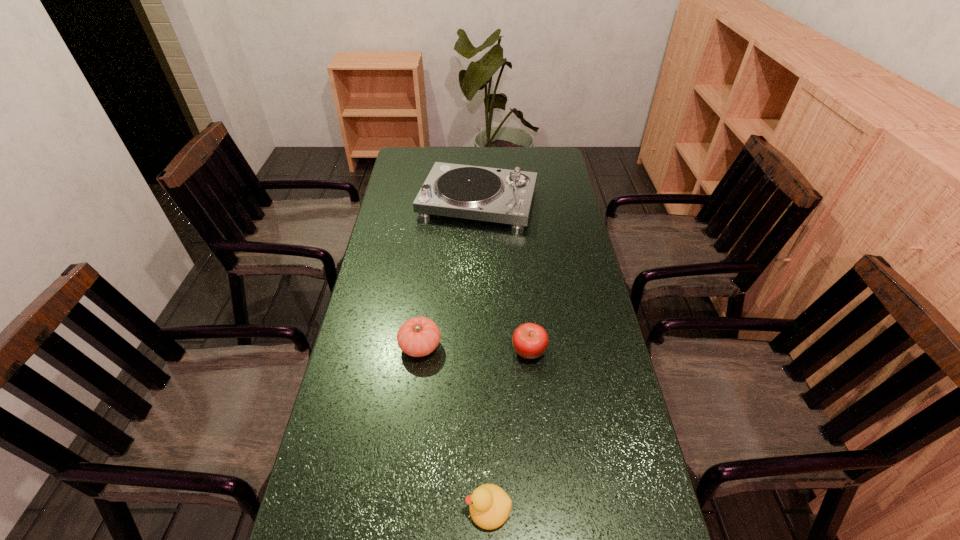
The width and height of the screenshot is (960, 540). What are the coordinates of `vacant area that lies between the tomato and the shortest object` in the screenshot? It's located at (454, 427).

You are a GUI agent. You are given a task and a screenshot of the screen. Output one action in this format:
    pyautogui.click(x=<x>, y=<y>)
    Task: Click on the vacant region between the apple and the nearest object
    
    Given the screenshot: What is the action you would take?
    pyautogui.click(x=509, y=429)

The image size is (960, 540). I want to click on vacant area between the apple and the farthest object, so click(x=504, y=276).

Identify the location of free space that is in between the farthest object and the apple. (504, 276).

Identify which object is located as the nearest to the shortest object. Please provide its 2D coordinates. Your answer should be formatted as a tuple, i.e. [(x, y)], where the tuple contains the x and y coordinates of a point satisfying the conditions above.

[(530, 341)]

Where is `object that can be found as the second closest to the tomato`? object that can be found as the second closest to the tomato is located at coordinates (489, 505).

At what (x,y) coordinates should I click in order to perform the action: click on free region that satisfies the following two spatial constraints: 1. on the front side of the tomato; 2. on the left side of the apple. Please return your answer as a coordinate pair (x, y). Looking at the image, I should click on (420, 350).

This screenshot has height=540, width=960. What are the coordinates of `vacant point that satisfies the following two spatial constraints: 1. on the back side of the farthest object; 2. on the left side of the tomato` in the screenshot? It's located at (438, 202).

You are a GUI agent. You are given a task and a screenshot of the screen. Output one action in this format:
    pyautogui.click(x=<x>, y=<y>)
    Task: Click on the vacant space that satisfies the following two spatial constraints: 1. on the front side of the apple; 2. on the right side of the record player
    The height and width of the screenshot is (540, 960).
    Given the screenshot: What is the action you would take?
    pyautogui.click(x=477, y=350)